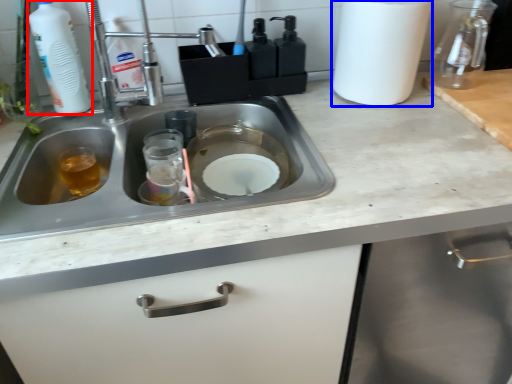
Question: Which point is closer to the camera, cleaning product (highlighted by a red box) or paper towel (highlighted by a blue box)?

Choices:
 (A) cleaning product
 (B) paper towel

Answer: (A)